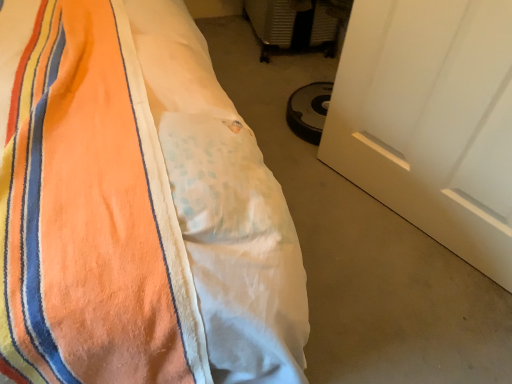
Question: Is the position of orange fleece blanket at left more distant than that of white matte door at lower right?

Choices:
 (A) yes
 (B) no

Answer: (B)

Question: Does orange fleece blanket at left have a lesser width compared to white matte door at lower right?

Choices:
 (A) no
 (B) yes

Answer: (A)

Question: Is orange fleece blanket at left positioned beyond the bounds of white matte door at lower right?

Choices:
 (A) no
 (B) yes

Answer: (B)

Question: From a real-world perspective, is orange fleece blanket at left positioned under white matte door at lower right based on gravity?

Choices:
 (A) yes
 (B) no

Answer: (B)

Question: Is orange fleece blanket at left at the right side of white matte door at lower right?

Choices:
 (A) no
 (B) yes

Answer: (A)

Question: From a real-world perspective, is orange fleece blanket at left above or below white fabric at lower left?

Choices:
 (A) above
 (B) below

Answer: (A)

Question: Considering their positions, is orange fleece blanket at left located in front of or behind white fabric at lower left?

Choices:
 (A) behind
 (B) front

Answer: (B)

Question: From the image's perspective, is orange fleece blanket at left positioned above or below white fabric at lower left?

Choices:
 (A) below
 (B) above

Answer: (B)

Question: Is point (11, 99) positioned closer to the camera than point (243, 97)?

Choices:
 (A) closer
 (B) farther

Answer: (A)

Question: Is white fabric at lower left inside or outside of white matte door at lower right?

Choices:
 (A) inside
 (B) outside

Answer: (B)

Question: Considering their positions, is white fabric at lower left located in front of or behind white matte door at lower right?

Choices:
 (A) front
 (B) behind

Answer: (B)

Question: In terms of height, does white fabric at lower left look taller or shorter compared to white matte door at lower right?

Choices:
 (A) tall
 (B) short

Answer: (B)

Question: Is point (334, 269) positioned closer to the camera than point (450, 233)?

Choices:
 (A) farther
 (B) closer

Answer: (B)

Question: From a real-world perspective, relative to white matte door at lower right, is orange fleece blanket at left vertically above or below?

Choices:
 (A) below
 (B) above

Answer: (B)

Question: From the image's perspective, is orange fleece blanket at left above or below white matte door at lower right?

Choices:
 (A) above
 (B) below

Answer: (A)